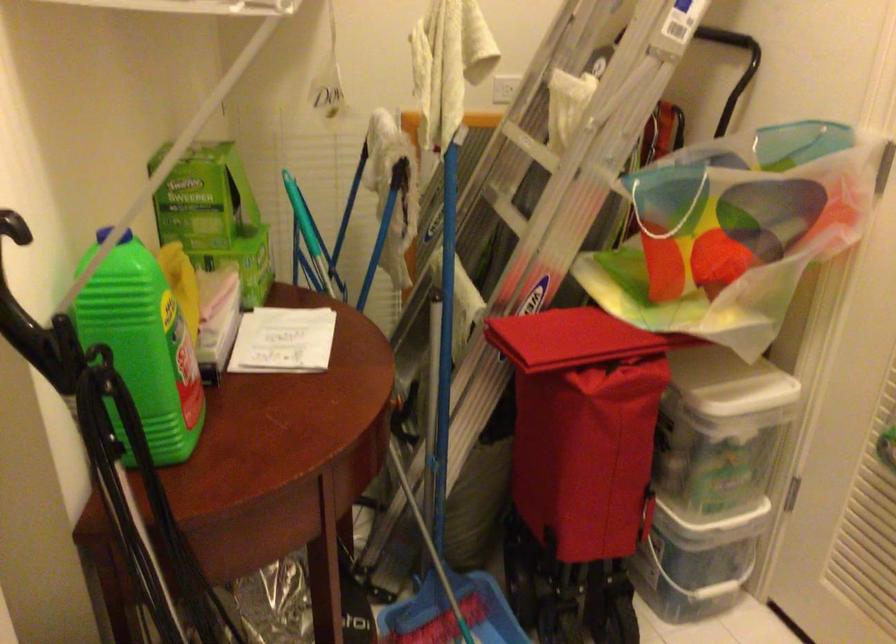
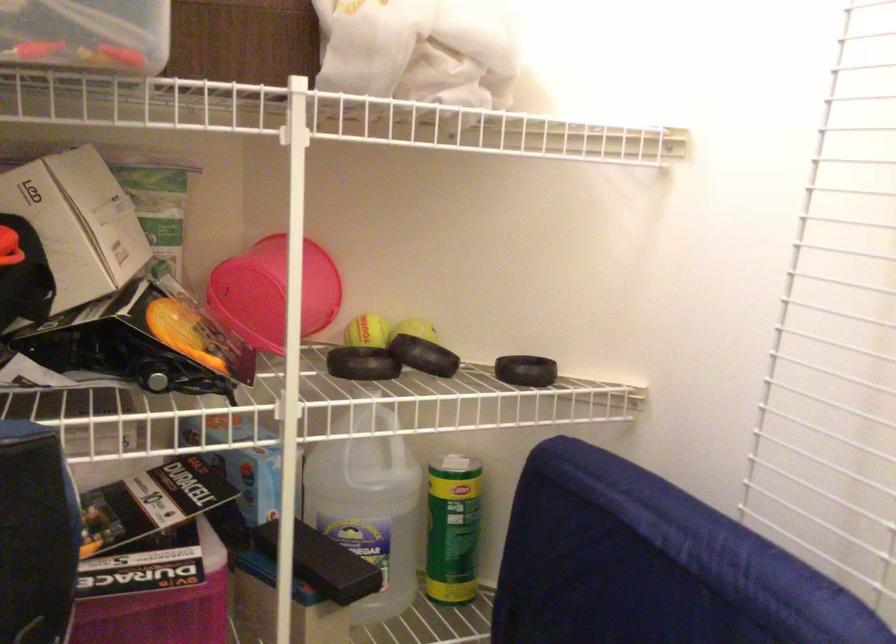
Question: The camera is either moving clockwise (left) or counter-clockwise (right) around the object. The first image is from the beginning of the video and the second image is from the end. Is the camera moving left or right when shooting the video?

Choices:
 (A) Left
 (B) Right

Answer: (B)